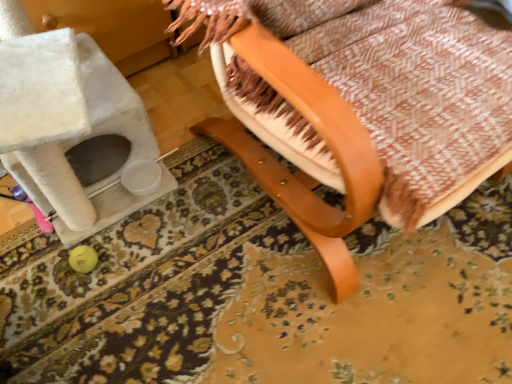
Identify the location of wooden rocking chair at upper right. This screenshot has width=512, height=384. (359, 106).

Consider the image. Measure the distance between point (388,209) and camera.

27.99 inches.

What do you see at coordinates (359, 106) in the screenshot? The image size is (512, 384). I see `wooden rocking chair at upper right` at bounding box center [359, 106].

Find the location of a particular element. This screenshot has height=384, width=512. wooden rocking chair at upper right is located at coordinates (359, 106).